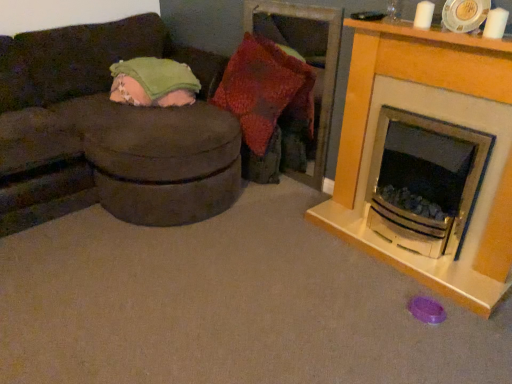
Question: Is white glossy fireplace at right oriented away from knitted fabric pillow at center?

Choices:
 (A) no
 (B) yes

Answer: (A)

Question: From the image's perspective, is white glossy fireplace at right located beneath knitted fabric pillow at center?

Choices:
 (A) yes
 (B) no

Answer: (A)

Question: Does white glossy fireplace at right have a greater height compared to knitted fabric pillow at center?

Choices:
 (A) no
 (B) yes

Answer: (B)

Question: Is white glossy fireplace at right smaller than knitted fabric pillow at center?

Choices:
 (A) no
 (B) yes

Answer: (A)

Question: From the image's perspective, is white glossy fireplace at right located above knitted fabric pillow at center?

Choices:
 (A) no
 (B) yes

Answer: (A)

Question: Looking at the image, does green soft blanket at upper left seem bigger or smaller compared to white glossy fireplace at right?

Choices:
 (A) small
 (B) big

Answer: (A)

Question: In terms of width, does green soft blanket at upper left look wider or thinner when compared to white glossy fireplace at right?

Choices:
 (A) wide
 (B) thin

Answer: (A)

Question: Considering the relative positions of green soft blanket at upper left and white glossy fireplace at right in the image provided, is green soft blanket at upper left to the left or to the right of white glossy fireplace at right?

Choices:
 (A) left
 (B) right

Answer: (A)

Question: Does point (117, 77) appear closer or farther from the camera than point (499, 259)?

Choices:
 (A) farther
 (B) closer

Answer: (A)

Question: From a real-world perspective, is white glossy fireplace at right positioned above or below suede-like brown studio couch at left?

Choices:
 (A) above
 (B) below

Answer: (A)

Question: Considering the positions of point (408, 259) and point (46, 122), is point (408, 259) closer or farther from the camera than point (46, 122)?

Choices:
 (A) closer
 (B) farther

Answer: (A)

Question: Based on their sizes in the image, would you say white glossy fireplace at right is bigger or smaller than suede-like brown studio couch at left?

Choices:
 (A) small
 (B) big

Answer: (A)

Question: Is white glossy fireplace at right spatially inside suede-like brown studio couch at left, or outside of it?

Choices:
 (A) inside
 (B) outside

Answer: (B)

Question: Relative to white glossy fireplace at right, is knitted fabric pillow at center in front or behind?

Choices:
 (A) behind
 (B) front

Answer: (A)

Question: Does point (253, 135) appear closer or farther from the camera than point (394, 66)?

Choices:
 (A) closer
 (B) farther

Answer: (B)